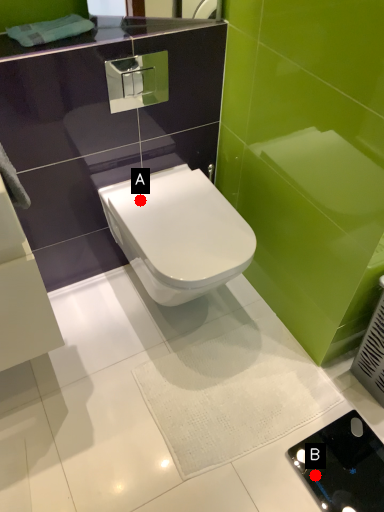
Question: Two points are circled on the image, labeled by A and B beside each circle. Which point appears closest to the camera in this image?

Choices:
 (A) A is closer
 (B) B is closer

Answer: (B)